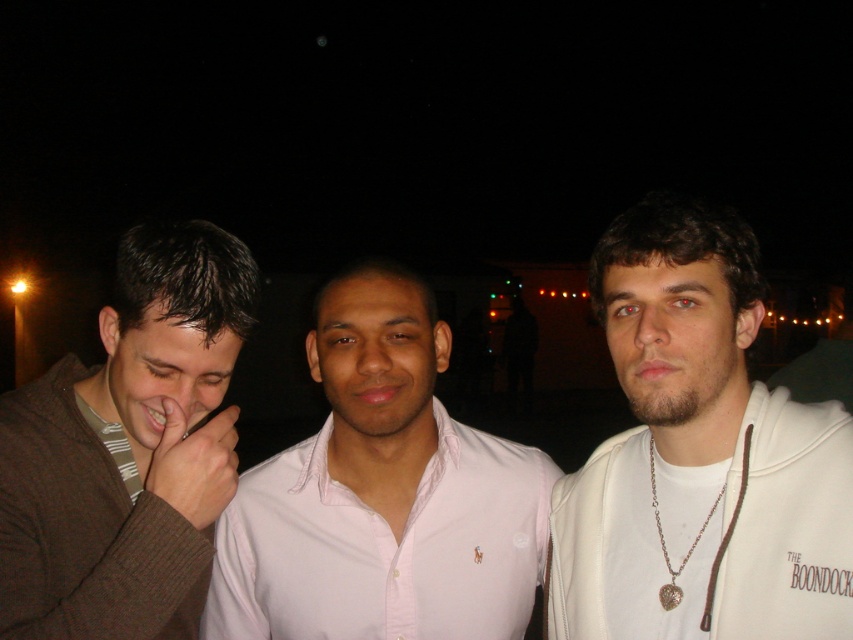
Is brown wool sweater at left smaller than matte brown hand at center?

Actually, brown wool sweater at left might be larger than matte brown hand at center.

Is point (138, 528) closer to camera compared to point (175, 436)?

Yes, it is in front of point (175, 436).

The image size is (853, 640). I want to click on brown wool sweater at left, so click(x=128, y=449).

Between point (289, 480) and point (177, 456), which one is positioned in front?

Point (177, 456) is in front.

Between pink cotton shirt at center and matte brown hand at center, which one has more height?

With more height is pink cotton shirt at center.

Who is more forward, [527,468] or [213,500]?

Positioned in front is point [213,500].

The image size is (853, 640). I want to click on pink cotton shirt at center, so click(x=383, y=547).

Which of these two, white matte hoodie at center or brown wool sweater at left, stands shorter?

brown wool sweater at left

Can you confirm if white matte hoodie at center is positioned below brown wool sweater at left?

Indeed, white matte hoodie at center is positioned under brown wool sweater at left.

Who is more forward, (642, 573) or (120, 308)?

Positioned in front is point (642, 573).

At what (x,y) coordinates should I click in order to perform the action: click on white matte hoodie at center. Please return your answer as a coordinate pair (x, y). Looking at the image, I should click on (699, 452).